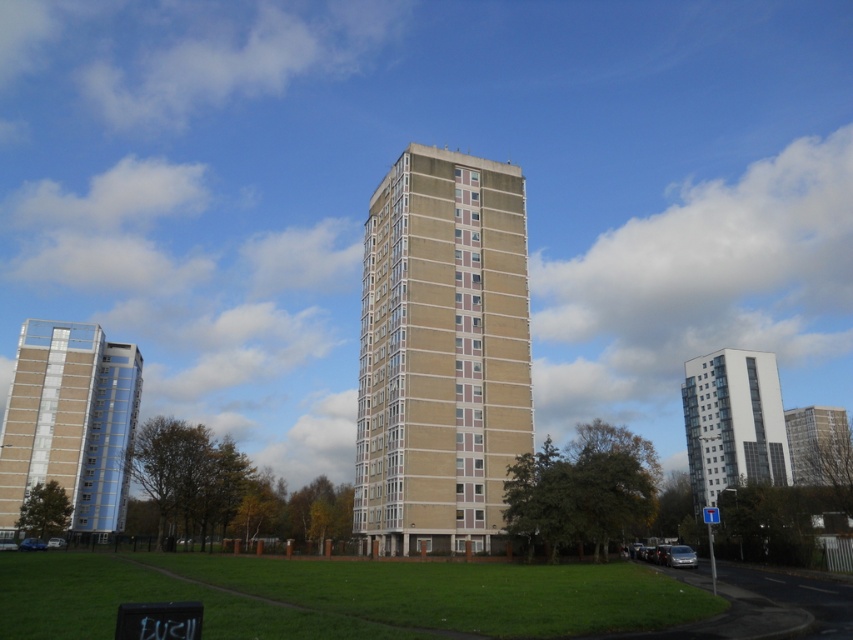
You are a city planner analyzing the urban layout. You observe the beige concrete tower at center and the white glass building at upper center. Which of these two structures is situated higher in the image?

The beige concrete tower at center is positioned over the white glass building at upper center, meaning it is higher in the image.

You are a drone operator who needs to fly a drone from the metallic glass tower at left to the white glass building at upper center. The drone has a maximum flight range of 100 meters. Can the drone complete the journey without needing to recharge?

The distance between the metallic glass tower at left and the white glass building at upper center is 96.92 meters. Since the drone can fly up to 100 meters, it can complete the journey without needing to recharge.